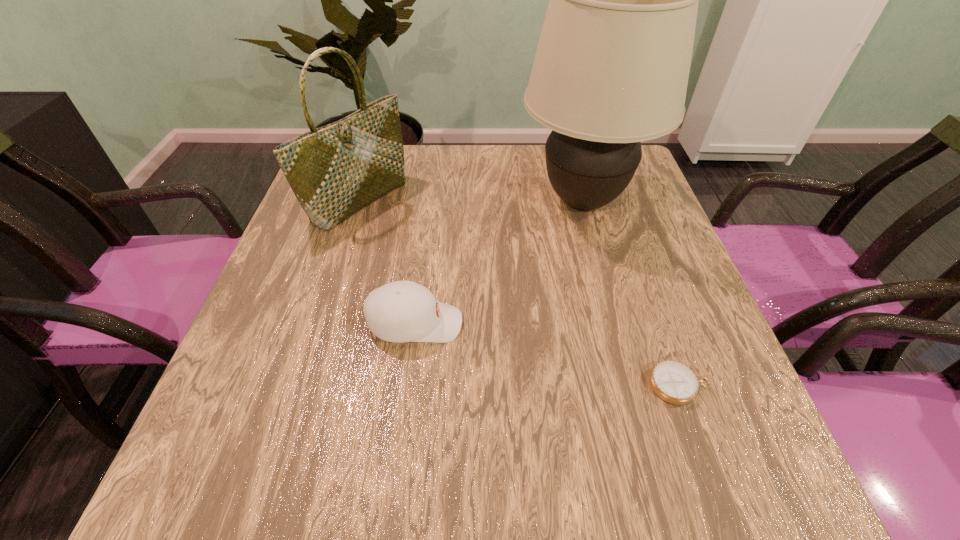
Where is `lampshade`? This screenshot has width=960, height=540. lampshade is located at coordinates (611, 69).

At what (x,y) coordinates should I click in order to perform the action: click on the third shortest object. Please return your answer as a coordinate pair (x, y). This screenshot has width=960, height=540. Looking at the image, I should click on (334, 171).

Identify the location of the third farthest object. This screenshot has height=540, width=960. (402, 311).

At what (x,y) coordinates should I click in order to perform the action: click on baseball cap. Please return your answer as a coordinate pair (x, y). Image resolution: width=960 pixels, height=540 pixels. Looking at the image, I should click on (402, 311).

This screenshot has height=540, width=960. In order to click on the nearest object in this screenshot , I will do `click(674, 382)`.

At what (x,y) coordinates should I click in order to perform the action: click on compass. Please return your answer as a coordinate pair (x, y). The width and height of the screenshot is (960, 540). Looking at the image, I should click on (674, 382).

Image resolution: width=960 pixels, height=540 pixels. Identify the location of free space located 0.320m on the left of the tallest object. (391, 201).

Find the location of a particular element. This screenshot has height=540, width=960. vacant space situated 0.280m on the right of the third shortest object is located at coordinates (514, 201).

I want to click on free space located on the front-facing side of the baseball cap, so click(x=608, y=323).

At what (x,y) coordinates should I click in order to perform the action: click on vacant space located 0.070m on the front of the nearest object. Please return your answer as a coordinate pair (x, y). The width and height of the screenshot is (960, 540). Looking at the image, I should click on (702, 448).